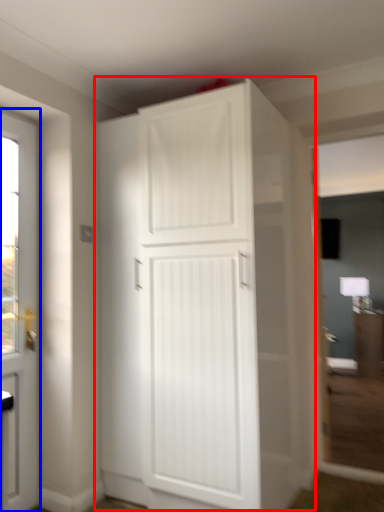
Question: Which object appears closest to the camera in this image, cupboard (highlighted by a red box) or door (highlighted by a blue box)?

Choices:
 (A) cupboard
 (B) door

Answer: (A)